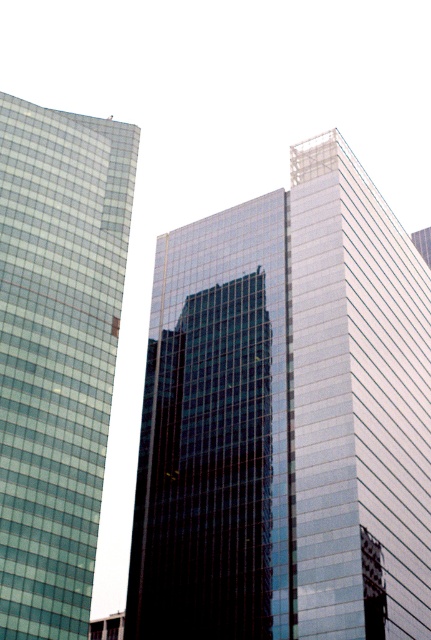
You are standing at the center of the image and want to locate the glassy reflective skyscraper at center. According to the coordinates provided, in which direction should you look to find it?

The glassy reflective skyscraper at center is located at coordinates point (286, 419), which means it is slightly to the upper right from the center point of the image.

You are standing in the middle of the city and see the glassy reflective skyscraper at center and the green glass building at left. Which one is closer to you?

The glassy reflective skyscraper at center is closer to you since it is positioned in front of the green glass building at left.

You are an architect evaluating the design of the glassy reflective skyscraper at center and the green glass building at left. Which building would you recommend for a client who wants a more prominent structure in the city skyline?

The glassy reflective skyscraper at center is bigger than the green glass building at left, so it would be the better choice for a client seeking a more prominent structure in the city skyline.